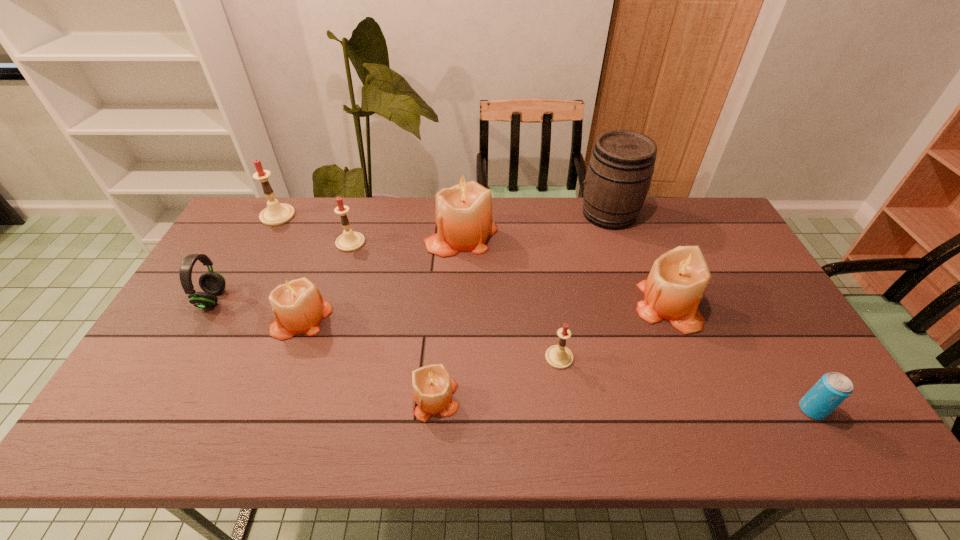
Identify the location of vacant space located on the left of the second smallest beige candle. This screenshot has width=960, height=540. (176, 319).

The width and height of the screenshot is (960, 540). Find the location of `free space located 0.140m on the ear cups of the black headset`. free space located 0.140m on the ear cups of the black headset is located at coordinates (273, 299).

Find the location of a particular element. The image size is (960, 540). vacant area situated on the right of the seventh object from left to right is located at coordinates (708, 357).

You are a GUI agent. You are given a task and a screenshot of the screen. Output one action in this format:
    pyautogui.click(x=<x>, y=<y>)
    Task: Click on the free space located on the back of the nearest candle
    Image resolution: width=960 pixels, height=540 pixels.
    Given the screenshot: What is the action you would take?
    pyautogui.click(x=440, y=354)

Where is `blank space located on the back of the soda can`? This screenshot has height=540, width=960. blank space located on the back of the soda can is located at coordinates (759, 319).

Find the location of a particular element. This screenshot has width=960, height=540. wine bucket at the far edge is located at coordinates click(620, 170).

Find the location of a particular element. The width and height of the screenshot is (960, 540). candle at the near edge is located at coordinates (432, 385).

At what (x,y) coordinates should I click in order to perform the action: click on soda can present at the near edge. Please return your answer as a coordinate pair (x, y). This screenshot has width=960, height=540. Looking at the image, I should click on (833, 388).

Identify the location of candle positioned at the left edge. The image size is (960, 540). (275, 213).

Find the location of `headset present at the left edge`. headset present at the left edge is located at coordinates tap(212, 283).